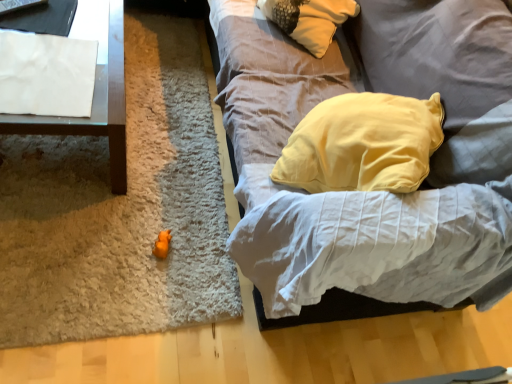
Locate an element on the screen. This screenshot has width=512, height=384. vacant space in white paper at upper left (from a real-world perspective) is located at coordinates (40, 72).